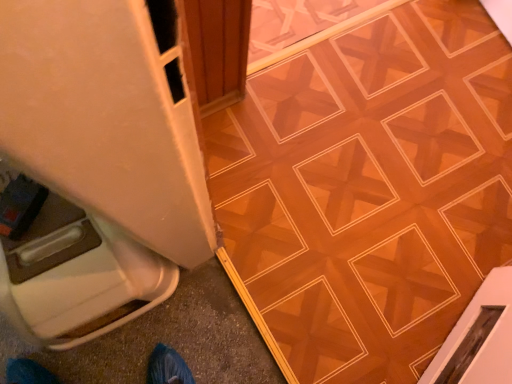
Question: Choose the correct answer: Is wooden parquet floor at center inside white plastic container at lower left or outside it?

Choices:
 (A) outside
 (B) inside

Answer: (A)

Question: Does point (378, 33) appear closer or farther from the camera than point (66, 193)?

Choices:
 (A) farther
 (B) closer

Answer: (A)

Question: Looking at their shapes, would you say wooden parquet floor at center is wider or thinner than white plastic container at lower left?

Choices:
 (A) wide
 (B) thin

Answer: (A)

Question: Is white plastic container at lower left spatially inside wooden parquet floor at center, or outside of it?

Choices:
 (A) inside
 (B) outside

Answer: (B)

Question: Is white plastic container at lower left taller or shorter than wooden parquet floor at center?

Choices:
 (A) tall
 (B) short

Answer: (A)

Question: Relative to wooden parquet floor at center, is white plastic container at lower left in front or behind?

Choices:
 (A) behind
 (B) front

Answer: (B)

Question: From a real-world perspective, relative to wooden parquet floor at center, is white plastic container at lower left vertically above or below?

Choices:
 (A) above
 (B) below

Answer: (A)